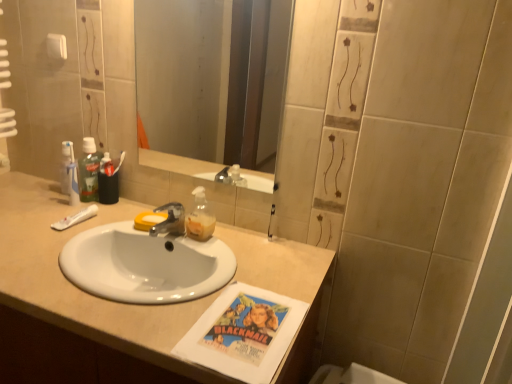
At what (x,y) coordinates should I click in order to perform the action: click on free space in front of white matte toothpaste at left. Please return your answer as a coordinate pair (x, y). Looking at the image, I should click on [57, 250].